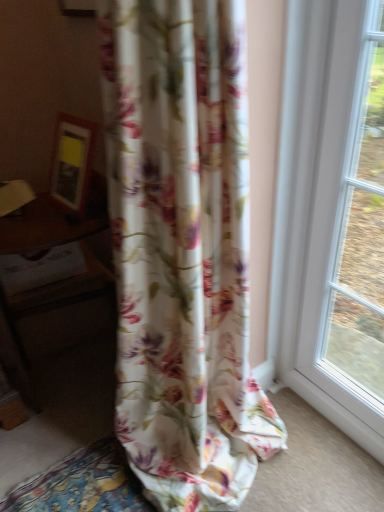
Locate an element on the screen. The width and height of the screenshot is (384, 512). vacant space that is in between floral fabric curtain at center and wooden table at left is located at coordinates (81, 455).